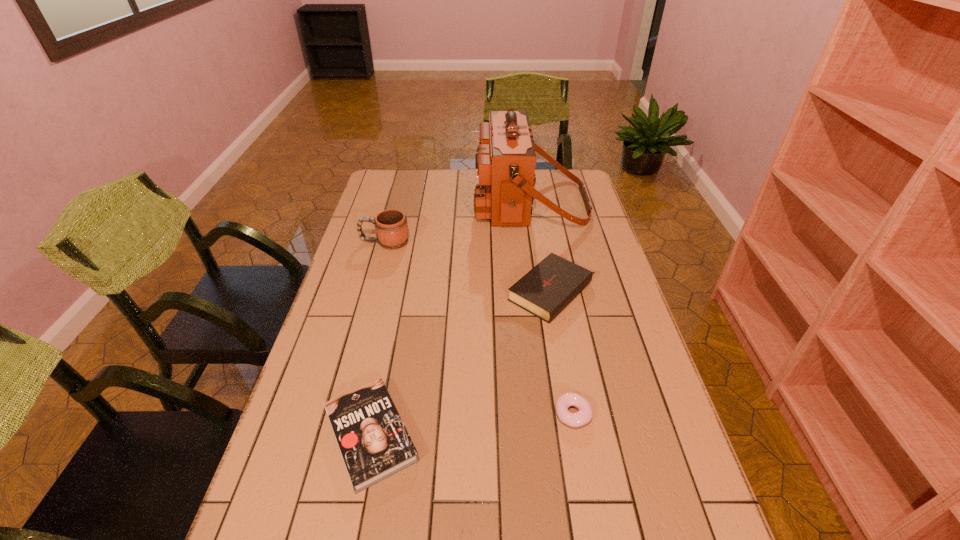
What are the coordinates of `vacant region located on the back of the doughnut` in the screenshot? It's located at (562, 350).

In order to click on vacant region located 0.390m on the back of the book in this screenshot , I will do `click(401, 283)`.

This screenshot has height=540, width=960. What are the coordinates of `object located in the far edge section of the desktop` in the screenshot? It's located at (505, 161).

This screenshot has height=540, width=960. In order to click on mug that is positioned at the left edge in this screenshot , I will do `click(391, 226)`.

The image size is (960, 540). I want to click on book that is at the left edge, so click(x=374, y=443).

Find the location of a particular element. The height and width of the screenshot is (540, 960). satchel that is at the right edge is located at coordinates (505, 161).

Identify the location of Bible located at the right edge. The image size is (960, 540). (552, 284).

Locate an element on the screen. Image resolution: width=960 pixels, height=540 pixels. object present at the far right corner is located at coordinates coord(505,161).

This screenshot has height=540, width=960. In the image, there is a desktop. What are the coordinates of `vacant space at the far edge` in the screenshot? It's located at (541, 177).

The image size is (960, 540). In the image, there is a desktop. Find the location of `vacant space at the left edge`. vacant space at the left edge is located at coordinates (310, 411).